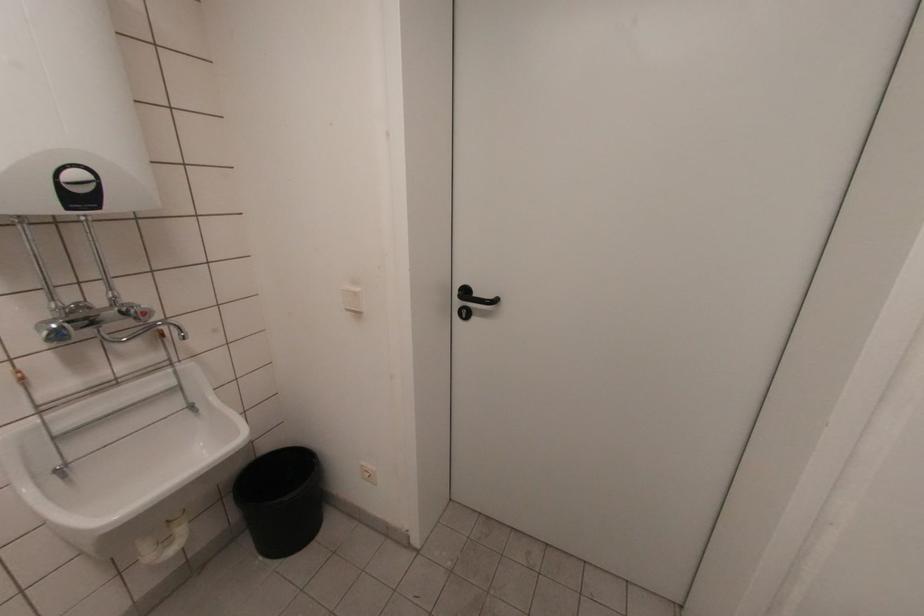
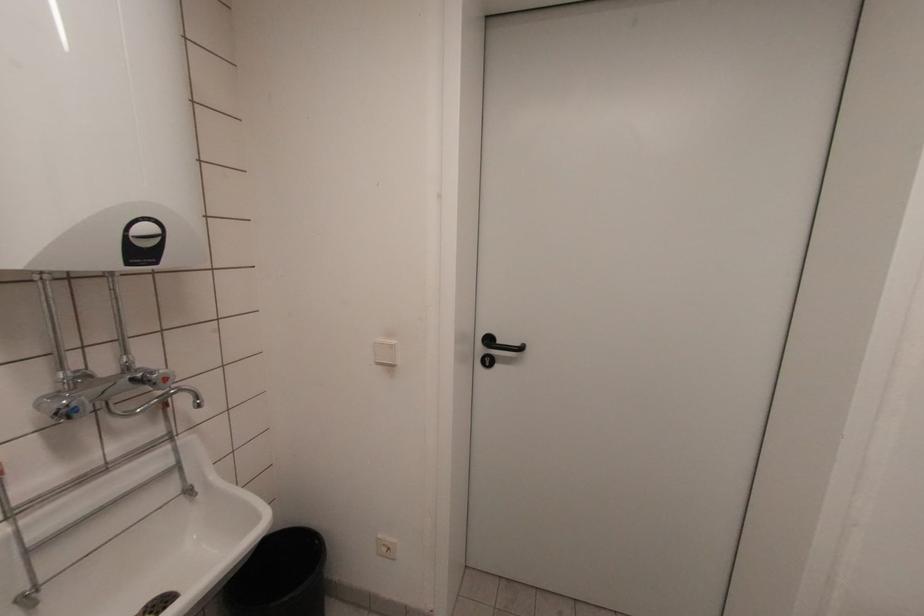
In the second image, find the point that corresponds to the point at 91,206 in the first image.

(151, 261)